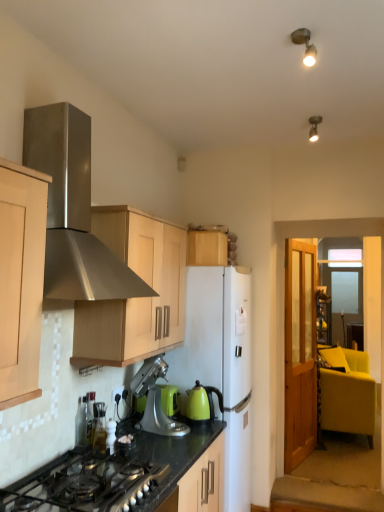
In order to click on vacant space that is in between clear glass bottle at center, the 2th appliance positioned from the left, and green matte kettle at center, the 1th kitchen appliance in the right-to-left sequence in this screenshot , I will do `click(166, 434)`.